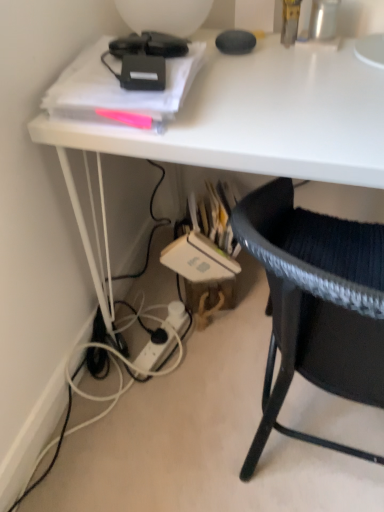
Question: Is black woven chair at lower right smaller than white glossy desk at upper center?

Choices:
 (A) yes
 (B) no

Answer: (A)

Question: From the image's perspective, is black woven chair at lower right located beneath white glossy desk at upper center?

Choices:
 (A) no
 (B) yes

Answer: (B)

Question: Can you confirm if black woven chair at lower right is shorter than white glossy desk at upper center?

Choices:
 (A) yes
 (B) no

Answer: (A)

Question: Considering the relative sizes of black woven chair at lower right and white glossy desk at upper center in the image provided, is black woven chair at lower right taller than white glossy desk at upper center?

Choices:
 (A) no
 (B) yes

Answer: (A)

Question: From the image's perspective, is black woven chair at lower right on top of white glossy desk at upper center?

Choices:
 (A) yes
 (B) no

Answer: (B)

Question: Is black woven chair at lower right to the left of white glossy desk at upper center from the viewer's perspective?

Choices:
 (A) yes
 (B) no

Answer: (B)

Question: Is white plastic power outlet at lower center to the right of black woven chair at lower right from the viewer's perspective?

Choices:
 (A) no
 (B) yes

Answer: (A)

Question: Is white plastic power outlet at lower center further to camera compared to black woven chair at lower right?

Choices:
 (A) no
 (B) yes

Answer: (B)

Question: Considering the relative sizes of white plastic power outlet at lower center and black woven chair at lower right in the image provided, is white plastic power outlet at lower center wider than black woven chair at lower right?

Choices:
 (A) yes
 (B) no

Answer: (B)

Question: From the image's perspective, is white plastic power outlet at lower center on black woven chair at lower right?

Choices:
 (A) yes
 (B) no

Answer: (B)

Question: Can you confirm if white plastic power outlet at lower center is taller than black woven chair at lower right?

Choices:
 (A) yes
 (B) no

Answer: (B)

Question: From the image's perspective, would you say white plastic power outlet at lower center is shown under black woven chair at lower right?

Choices:
 (A) no
 (B) yes

Answer: (B)

Question: Can you confirm if white plastic power outlet at lower center is positioned to the left of white glossy desk at upper center?

Choices:
 (A) no
 (B) yes

Answer: (B)